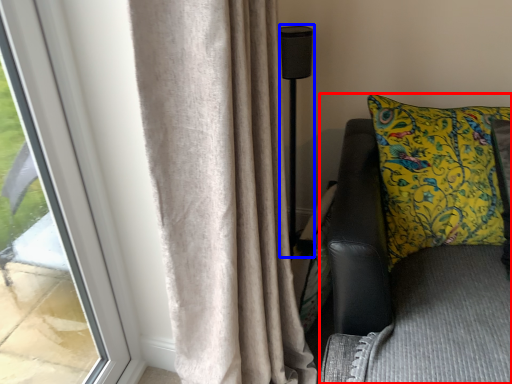
Question: Which point is closer to the camera, furniture (highlighted by a red box) or lamp (highlighted by a blue box)?

Choices:
 (A) furniture
 (B) lamp

Answer: (A)